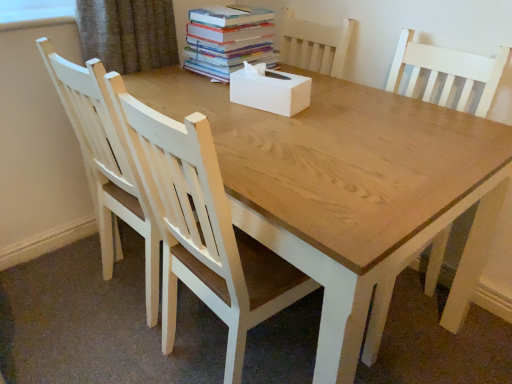
Describe the element at coordinates (202, 228) in the screenshot. Image resolution: width=512 pixels, height=384 pixels. I see `white wood chair at center, the second chair positioned from the left` at that location.

This screenshot has height=384, width=512. I want to click on white wood chair at center, which is the first chair from right to left, so click(202, 228).

Is white matte tissue box at center bigger than hardcover books at upper center?

Incorrect, white matte tissue box at center is not larger than hardcover books at upper center.

From the image's perspective, who appears lower, white matte tissue box at center or hardcover books at upper center?

white matte tissue box at center, from the image's perspective.

Is white matte tissue box at center looking in the opposite direction of hardcover books at upper center?

white matte tissue box at center is not turned away from hardcover books at upper center.

Considering the positions of point (190, 66) and point (115, 200), is point (190, 66) closer or farther from the camera than point (115, 200)?

Point (190, 66) is farther from the camera than point (115, 200).

From the image's perspective, is hardcover books at upper center below white wood chair at left, which is the 1th chair from left to right?

No, from the image's perspective, hardcover books at upper center is not below white wood chair at left, which is the 1th chair from left to right.

Can you confirm if hardcover books at upper center is smaller than white wood chair at left, which ranks as the second chair in right-to-left order?

Indeed, hardcover books at upper center has a smaller size compared to white wood chair at left, which ranks as the second chair in right-to-left order.

Which object is wider, hardcover books at upper center or white wood chair at left, which is the 1th chair from left to right?

Wider between the two is white wood chair at left, which is the 1th chair from left to right.

From the image's perspective, which is above, white matte tissue box at center or white wood chair at center, the second chair positioned from the left?

From the image's view, white matte tissue box at center is above.

In the scene shown: Considering the positions of objects white matte tissue box at center and white wood chair at center, the second chair positioned from the left, in the image provided, who is more to the left, white matte tissue box at center or white wood chair at center, the second chair positioned from the left,?

white wood chair at center, the second chair positioned from the left.

Are white matte tissue box at center and white wood chair at center, which is the first chair from right to left, beside each other?

They are not placed beside each other.

Identify the location of book above the white wood chair at center, which is the first chair from right to left (from a real-world perspective). This screenshot has height=384, width=512. (228, 39).

Would you say hardcover books at upper center contains white wood chair at center, the second chair positioned from the left?

No, white wood chair at center, the second chair positioned from the left, is not inside hardcover books at upper center.

Consider the image. From the image's perspective, is hardcover books at upper center below white wood chair at center, which is the first chair from right to left?

No, from the image's perspective, hardcover books at upper center is not below white wood chair at center, which is the first chair from right to left.

Is point (226, 40) closer or farther from the camera than point (251, 283)?

Point (226, 40) is farther from the camera than point (251, 283).

Is the depth of white wood chair at left, which is the 1th chair from left to right, less than that of hardcover books at upper center?

Yes, it is.

Considering the positions of point (96, 136) and point (233, 40), is point (96, 136) closer or farther from the camera than point (233, 40)?

Point (96, 136).

From the image's perspective, is white wood chair at left, which is the 1th chair from left to right, located above hardcover books at upper center?

Incorrect, from the image's perspective, white wood chair at left, which is the 1th chair from left to right, is lower than hardcover books at upper center.

Between white wood chair at left, which ranks as the second chair in right-to-left order, and hardcover books at upper center, which one has larger size?

Bigger between the two is white wood chair at left, which ranks as the second chair in right-to-left order.

Which of these two, white wood chair at left, which ranks as the second chair in right-to-left order, or white matte tissue box at center, stands taller?

white wood chair at left, which ranks as the second chair in right-to-left order, is taller.

From a real-world perspective, is white wood chair at left, which ranks as the second chair in right-to-left order, on top of white matte tissue box at center?

No, from a real-world perspective, white wood chair at left, which ranks as the second chair in right-to-left order, is not on top of white matte tissue box at center.

Is white wood chair at left, which ranks as the second chair in right-to-left order, inside or outside of white matte tissue box at center?

white wood chair at left, which ranks as the second chair in right-to-left order, cannot be found inside white matte tissue box at center.

Which of these two, white wood chair at left, which ranks as the second chair in right-to-left order, or white matte tissue box at center, is smaller?

white matte tissue box at center is smaller.

Considering the relative positions of white wood chair at center, the second chair positioned from the left, and white wood chair at left, which is the 1th chair from left to right, in the image provided, is white wood chair at center, the second chair positioned from the left, to the right of white wood chair at left, which is the 1th chair from left to right, from the viewer's perspective?

Indeed, white wood chair at center, the second chair positioned from the left, is positioned on the right side of white wood chair at left, which is the 1th chair from left to right.

Does white wood chair at center, the second chair positioned from the left, have a larger size compared to white wood chair at left, which ranks as the second chair in right-to-left order?

Indeed, white wood chair at center, the second chair positioned from the left, has a larger size compared to white wood chair at left, which ranks as the second chair in right-to-left order.

From the image's perspective, which one is positioned lower, white wood chair at center, the second chair positioned from the left, or white wood chair at left, which is the 1th chair from left to right?

white wood chair at center, the second chair positioned from the left, appears lower in the image.

From a real-world perspective, is white wood chair at center, the second chair positioned from the left, over white wood chair at left, which ranks as the second chair in right-to-left order?

No, from a real-world perspective, white wood chair at center, the second chair positioned from the left, is not on top of white wood chair at left, which ranks as the second chair in right-to-left order.

The width and height of the screenshot is (512, 384). Find the location of `box below the hardcover books at upper center (from the image's perspective)`. box below the hardcover books at upper center (from the image's perspective) is located at coordinates (270, 90).

Find the location of a particular element. The image size is (512, 384). book above the white wood chair at left, which is the 1th chair from left to right (from the image's perspective) is located at coordinates (228, 39).

Estimate the real-world distances between objects in this image. Which object is closer to hardcover books at upper center, white wood chair at center, the second chair positioned from the left, or white matte tissue box at center?

Among the two, white matte tissue box at center is located nearer to hardcover books at upper center.

Estimate the real-world distances between objects in this image. Which object is further from white wood chair at center, which is the first chair from right to left, hardcover books at upper center or white matte tissue box at center?

hardcover books at upper center lies further to white wood chair at center, which is the first chair from right to left, than the other object.

Considering their positions, is white wood chair at left, which is the 1th chair from left to right, positioned further to white matte tissue box at center than hardcover books at upper center?

Based on the image, white wood chair at left, which is the 1th chair from left to right, appears to be further to white matte tissue box at center.

In the scene shown: Which object lies nearer to the anchor point white wood chair at center, the second chair positioned from the left, white matte tissue box at center or white wood chair at left, which is the 1th chair from left to right?

The object closer to white wood chair at center, the second chair positioned from the left, is white wood chair at left, which is the 1th chair from left to right.

Estimate the real-world distances between objects in this image. Which object is further from white matte tissue box at center, hardcover books at upper center or white wood chair at left, which ranks as the second chair in right-to-left order?

The object further to white matte tissue box at center is white wood chair at left, which ranks as the second chair in right-to-left order.

From the image, which object appears to be farther from hardcover books at upper center, white matte tissue box at center or white wood chair at left, which is the 1th chair from left to right?

white wood chair at left, which is the 1th chair from left to right, is positioned further to the anchor hardcover books at upper center.

When comparing their distances from white wood chair at center, the second chair positioned from the left, does hardcover books at upper center or white wood chair at left, which ranks as the second chair in right-to-left order, seem further?

hardcover books at upper center lies further to white wood chair at center, the second chair positioned from the left, than the other object.

Which object lies further to the anchor point white wood chair at left, which ranks as the second chair in right-to-left order, white wood chair at center, which is the first chair from right to left, or white matte tissue box at center?

Based on the image, white matte tissue box at center appears to be further to white wood chair at left, which ranks as the second chair in right-to-left order.

The width and height of the screenshot is (512, 384). I want to click on box that lies between hardcover books at upper center and white wood chair at left, which is the 1th chair from left to right, from top to bottom, so click(270, 90).

Where is `chair between white wood chair at center, which is the first chair from right to left, and white matte tissue box at center from front to back`? The width and height of the screenshot is (512, 384). chair between white wood chair at center, which is the first chair from right to left, and white matte tissue box at center from front to back is located at coordinates (106, 166).

Find the location of `box positioned between white wood chair at center, the second chair positioned from the left, and hardcover books at upper center from near to far`. box positioned between white wood chair at center, the second chair positioned from the left, and hardcover books at upper center from near to far is located at coordinates (270, 90).

The image size is (512, 384). What are the coordinates of `chair that lies between hardcover books at upper center and white wood chair at center, the second chair positioned from the left, from top to bottom` in the screenshot? It's located at (106, 166).